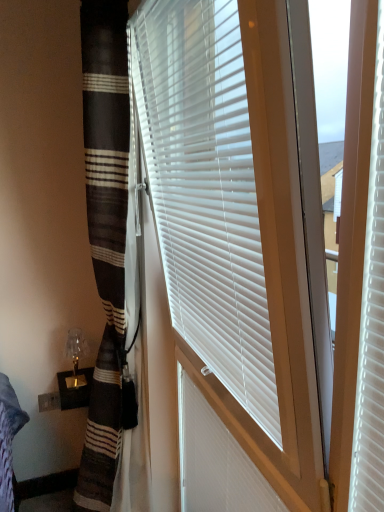
Question: From a real-world perspective, is white plastic shutter at center physically above translucent glass table lamp at lower left?

Choices:
 (A) yes
 (B) no

Answer: (B)

Question: Is white plastic shutter at center smaller than translucent glass table lamp at lower left?

Choices:
 (A) yes
 (B) no

Answer: (B)

Question: Would you say white plastic shutter at center is a long distance from translucent glass table lamp at lower left?

Choices:
 (A) yes
 (B) no

Answer: (B)

Question: Is white plastic shutter at center taller than translucent glass table lamp at lower left?

Choices:
 (A) yes
 (B) no

Answer: (A)

Question: Is white plastic shutter at center wider than translucent glass table lamp at lower left?

Choices:
 (A) yes
 (B) no

Answer: (B)

Question: Considering the positions of white plastic shutter at center and translucent glass table lamp at lower left in the image, is white plastic shutter at center wider or thinner than translucent glass table lamp at lower left?

Choices:
 (A) wide
 (B) thin

Answer: (B)

Question: From a real-world perspective, is white plastic shutter at center above or below translucent glass table lamp at lower left?

Choices:
 (A) below
 (B) above

Answer: (A)

Question: Choose the correct answer: Is white plastic shutter at center inside translucent glass table lamp at lower left or outside it?

Choices:
 (A) inside
 (B) outside

Answer: (B)

Question: From the image's perspective, is white plastic shutter at center above or below translucent glass table lamp at lower left?

Choices:
 (A) above
 (B) below

Answer: (B)

Question: From a real-world perspective, is translucent glass table lamp at lower left above or below white plastic shutter at center?

Choices:
 (A) below
 (B) above

Answer: (B)

Question: Relative to white plastic shutter at center, is translucent glass table lamp at lower left in front or behind?

Choices:
 (A) front
 (B) behind

Answer: (B)

Question: Considering the relative positions of translucent glass table lamp at lower left and white plastic shutter at center in the image provided, is translucent glass table lamp at lower left to the left or to the right of white plastic shutter at center?

Choices:
 (A) right
 (B) left

Answer: (B)

Question: Considering the positions of translucent glass table lamp at lower left and white plastic shutter at center in the image, is translucent glass table lamp at lower left taller or shorter than white plastic shutter at center?

Choices:
 (A) short
 (B) tall

Answer: (A)

Question: Relative to translucent glass table lamp at lower left, is white plastic blinds at center in front or behind?

Choices:
 (A) behind
 (B) front

Answer: (B)

Question: From a real-world perspective, relative to translucent glass table lamp at lower left, is white plastic blinds at center vertically above or below?

Choices:
 (A) below
 (B) above

Answer: (B)